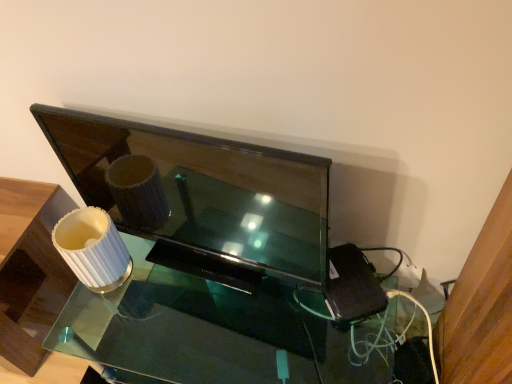
Question: From the image's perspective, is clear glass table at center below white ribbed lampshade at left?

Choices:
 (A) yes
 (B) no

Answer: (A)

Question: Is white ribbed lampshade at left located within clear glass table at center?

Choices:
 (A) yes
 (B) no

Answer: (B)

Question: Is clear glass table at center outside white ribbed lampshade at left?

Choices:
 (A) yes
 (B) no

Answer: (A)

Question: Can you confirm if clear glass table at center is wider than white ribbed lampshade at left?

Choices:
 (A) yes
 (B) no

Answer: (B)

Question: Can you confirm if clear glass table at center is bigger than white ribbed lampshade at left?

Choices:
 (A) yes
 (B) no

Answer: (A)

Question: Can you confirm if clear glass table at center is shorter than white ribbed lampshade at left?

Choices:
 (A) yes
 (B) no

Answer: (A)

Question: Is clear glass table at center oriented away from matte black tv at center?

Choices:
 (A) no
 (B) yes

Answer: (A)

Question: Is clear glass table at center not close to matte black tv at center?

Choices:
 (A) no
 (B) yes

Answer: (A)

Question: From a real-world perspective, is clear glass table at center on matte black tv at center?

Choices:
 (A) no
 (B) yes

Answer: (A)

Question: From a real-world perspective, is clear glass table at center physically below matte black tv at center?

Choices:
 (A) no
 (B) yes

Answer: (B)

Question: Does clear glass table at center turn towards matte black tv at center?

Choices:
 (A) no
 (B) yes

Answer: (A)

Question: Is the position of clear glass table at center more distant than that of matte black tv at center?

Choices:
 (A) no
 (B) yes

Answer: (B)

Question: Considering the relative positions of matte black tv at center and white ribbed lampshade at left in the image provided, is matte black tv at center to the right of white ribbed lampshade at left from the viewer's perspective?

Choices:
 (A) no
 (B) yes

Answer: (B)